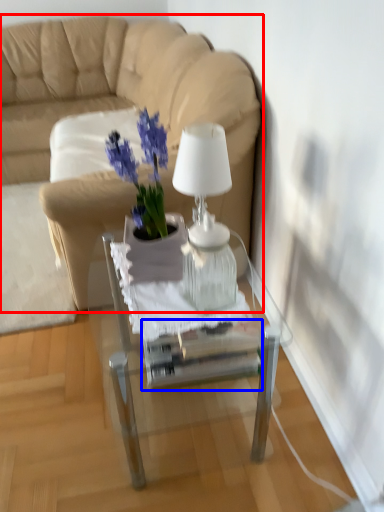
Question: Which object is closer to the camera taking this photo, studio couch (highlighted by a red box) or glass box (highlighted by a blue box)?

Choices:
 (A) studio couch
 (B) glass box

Answer: (B)